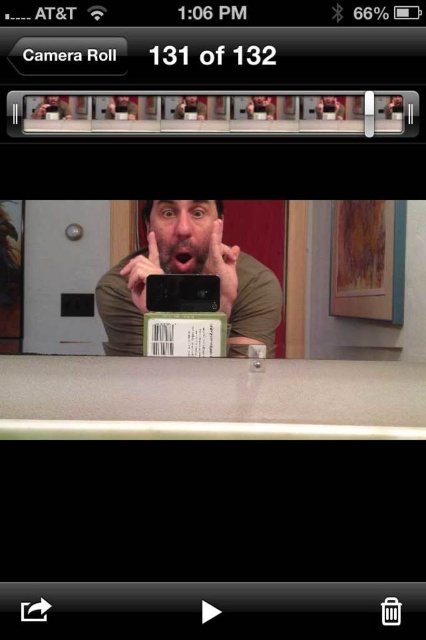
Can you confirm if matte black phone at center is thinner than black matte smartphone at center?

No, matte black phone at center is not thinner than black matte smartphone at center.

Measure the distance from matte black phone at center to black matte smartphone at center.

matte black phone at center is 2.78 inches away from black matte smartphone at center.

This screenshot has width=426, height=640. I want to click on matte black phone at center, so click(189, 273).